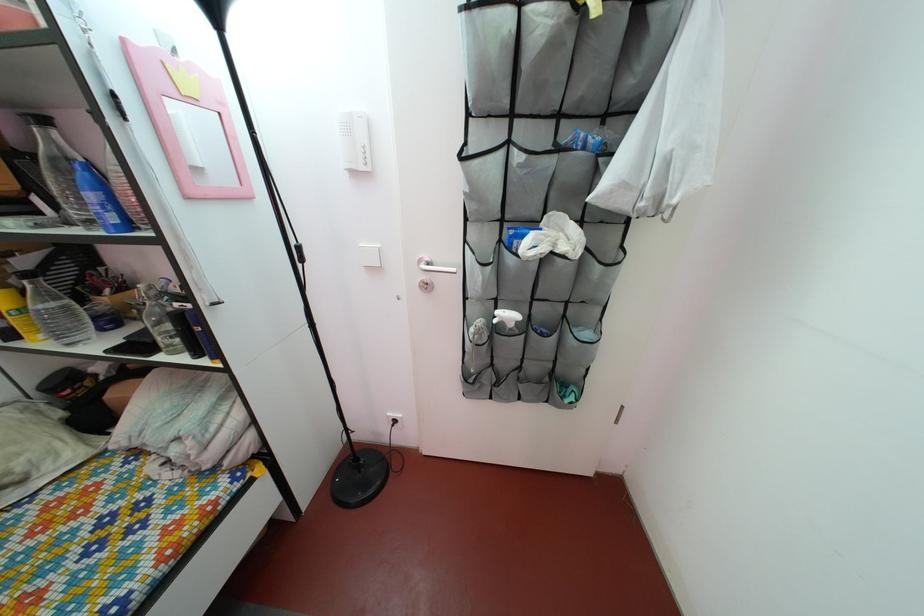
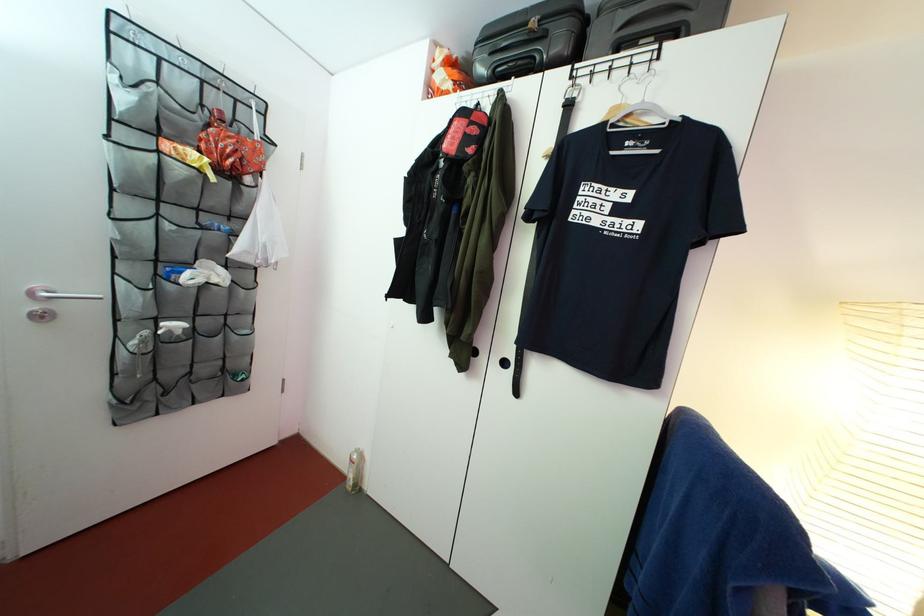
Question: The camera is either moving clockwise (left) or counter-clockwise (right) around the object. The first image is from the beginning of the video and the second image is from the end. Is the camera moving left or right when shooting the video?

Choices:
 (A) Left
 (B) Right

Answer: (A)